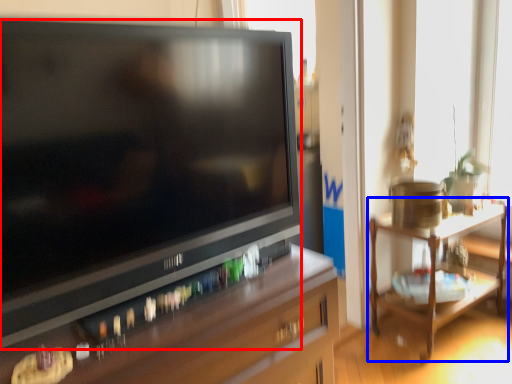
Question: Which object is further to the camera taking this photo, television (highlighted by a red box) or table (highlighted by a blue box)?

Choices:
 (A) television
 (B) table

Answer: (B)